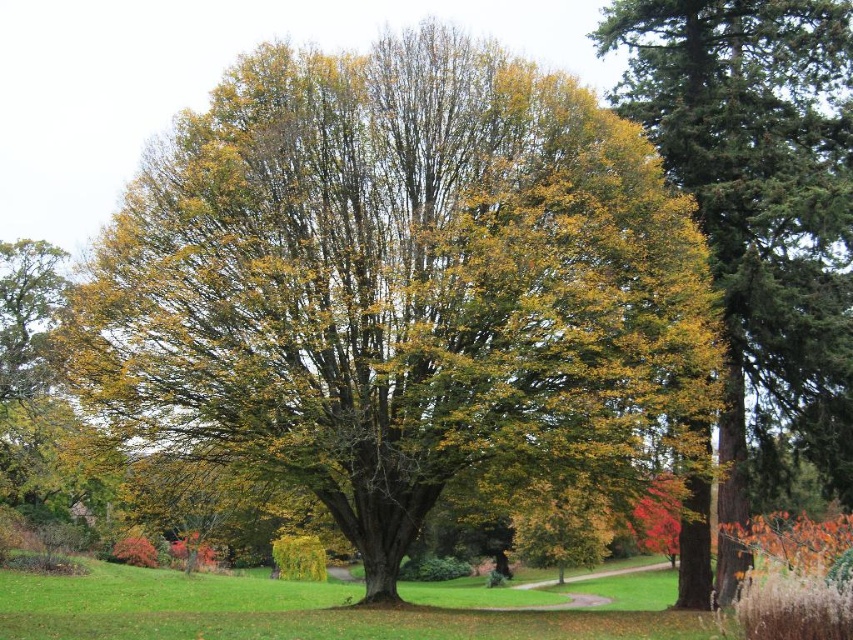
You are planning to plant a new tree in your backyard. You have two options from the image shown. The first option is the green leafy tree at center, and the second is the green textured tree at right. Which tree would you choose if you want a smaller tree for your garden?

The green leafy tree at center has a smaller size compared to the green textured tree at right, so you should choose the green leafy tree at center for a smaller tree in your garden.